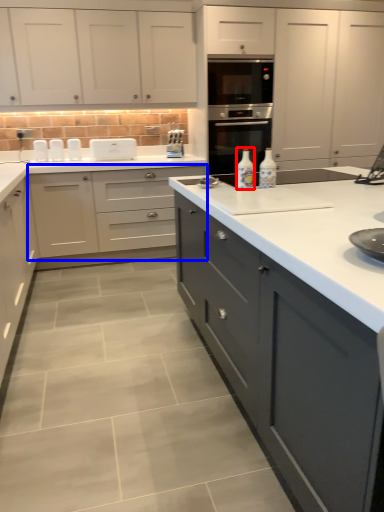
Question: Which of the following is the closest to the observer, bottle (highlighted by a red box) or cabinetry (highlighted by a blue box)?

Choices:
 (A) bottle
 (B) cabinetry

Answer: (A)